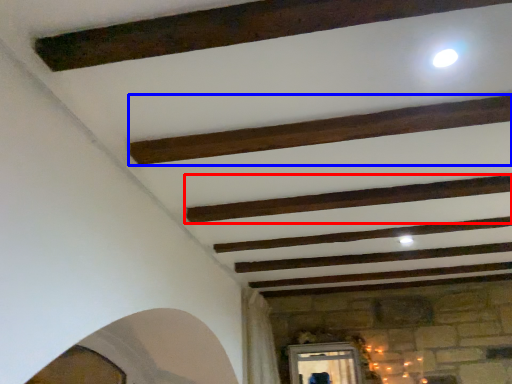
Question: Which of the following is the farthest to the observer, plank (highlighted by a red box) or plank (highlighted by a blue box)?

Choices:
 (A) plank
 (B) plank

Answer: (A)